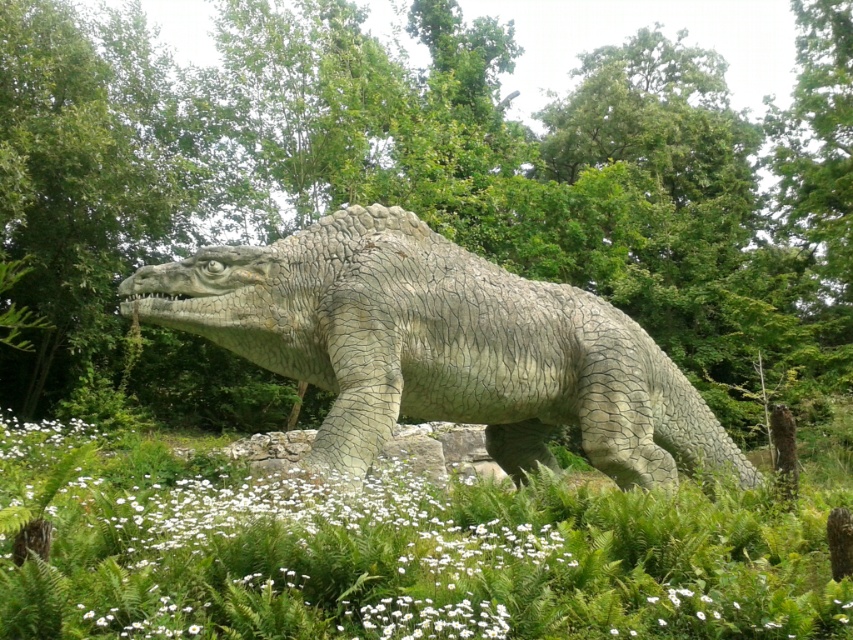
Identify the location of green leafy plants at center. (416, 192).

Between green leafy plants at center and gray textured dinosaur at center, which one has less height?

gray textured dinosaur at center

In order to click on green leafy plants at center in this screenshot , I will do `click(416, 192)`.

Can you confirm if green leafy grass at center is taller than gray textured dinosaur at center?

Indeed, green leafy grass at center has a greater height compared to gray textured dinosaur at center.

Can you confirm if green leafy grass at center is bigger than gray textured dinosaur at center?

Yes.

You are a GUI agent. You are given a task and a screenshot of the screen. Output one action in this format:
    pyautogui.click(x=<x>, y=<y>)
    Task: Click on the green leafy grass at center
    The height and width of the screenshot is (640, 853).
    Given the screenshot: What is the action you would take?
    pyautogui.click(x=416, y=556)

Who is higher up, green leafy plants at center or green leafy grass at center?

green leafy plants at center

Can you confirm if green leafy plants at center is wider than green leafy grass at center?

Indeed, green leafy plants at center has a greater width compared to green leafy grass at center.

Find the location of a particular element. The image size is (853, 640). green leafy plants at center is located at coordinates (416, 192).